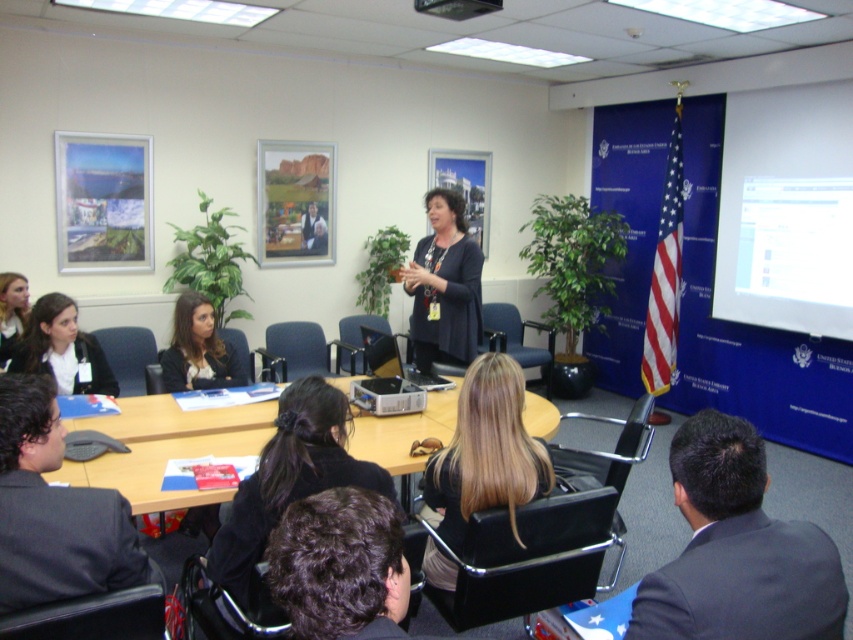
Question: Considering the real-world distances, which object is farthest from the dark gray suit at lower right?

Choices:
 (A) black fabric hair at center
 (B) white glossy projector screen at upper right
 (C) matte black shirt at center

Answer: (B)

Question: Which of these objects is positioned closest to the dark gray suit at lower left?

Choices:
 (A) white glossy projector screen at upper right
 (B) dark gray suit at lower right

Answer: (B)

Question: Can you confirm if dark gray suit at lower right is bigger than dark gray suit at lower left?

Choices:
 (A) yes
 (B) no

Answer: (B)

Question: Is dark gray suit at lower right above black plastic projector at upper center?

Choices:
 (A) yes
 (B) no

Answer: (B)

Question: Can you confirm if white glossy projector screen at upper right is positioned to the left of dark gray suit at lower left?

Choices:
 (A) no
 (B) yes

Answer: (A)

Question: Which object appears farthest from the camera in this image?

Choices:
 (A) black fabric hair at center
 (B) blonde hair at center

Answer: (B)